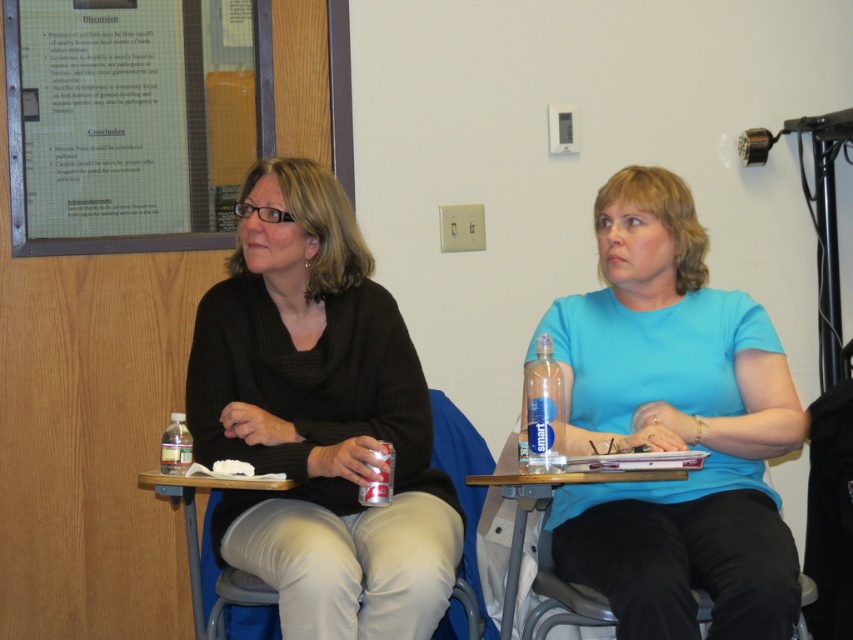
Question: Considering the real-world distances, which object is closest to the matte blue shirt at center?

Choices:
 (A) black sweater at left
 (B) matte glass bulletin board at upper left

Answer: (A)

Question: Which is farther from the matte blue shirt at center?

Choices:
 (A) wooden table at lower center
 (B) matte glass bulletin board at upper left
 (C) clear plastic water bottle at center

Answer: (B)

Question: Which point is farther from the camera taking this photo?

Choices:
 (A) (83, 236)
 (B) (595, 572)
 (C) (544, 388)
 (D) (184, 444)

Answer: (A)

Question: From the image, what is the correct spatial relationship of blue fabric chair at center in relation to clear plastic water bottle at center?

Choices:
 (A) left
 (B) right

Answer: (A)

Question: Is blue fabric chair at center wider than wooden table at lower center?

Choices:
 (A) no
 (B) yes

Answer: (A)

Question: From the image, what is the correct spatial relationship of matte blue shirt at center in relation to matte glass bulletin board at upper left?

Choices:
 (A) below
 (B) above

Answer: (A)